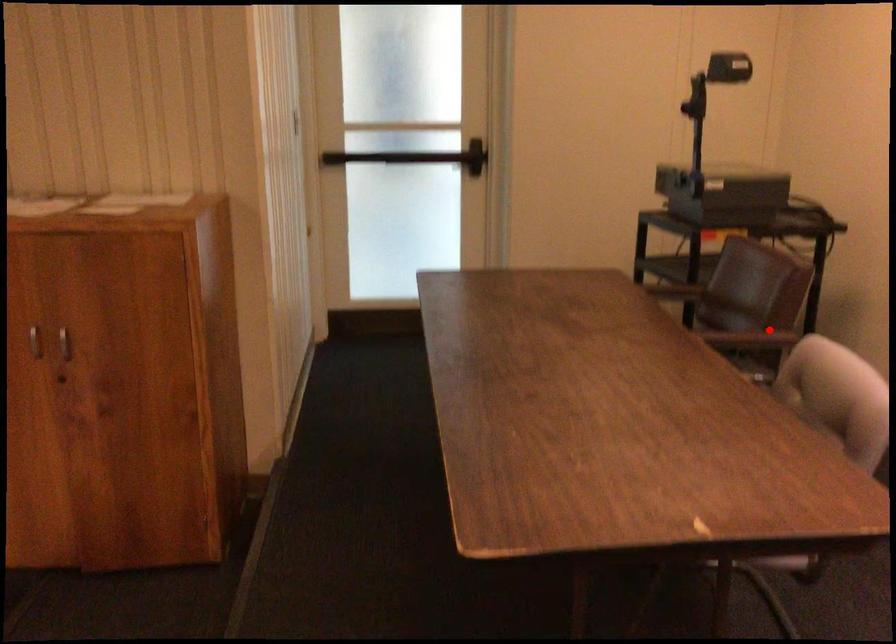
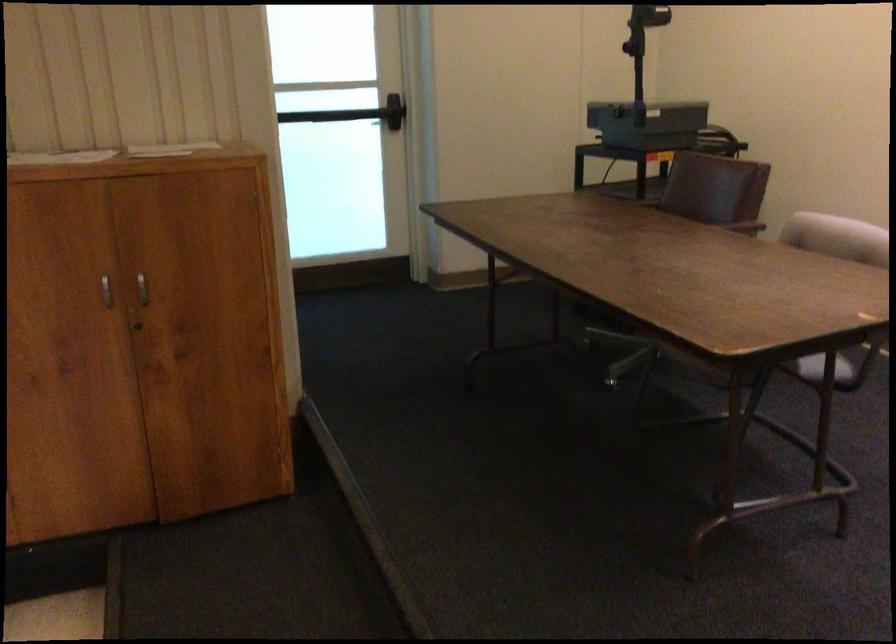
Question: I am providing you with two images of the same scene from different viewpoints. A red point is shown in image1. For the corresponding object point in image2, is it positioned nearer or farther from the camera?

Choices:
 (A) Nearer
 (B) Farther

Answer: (B)